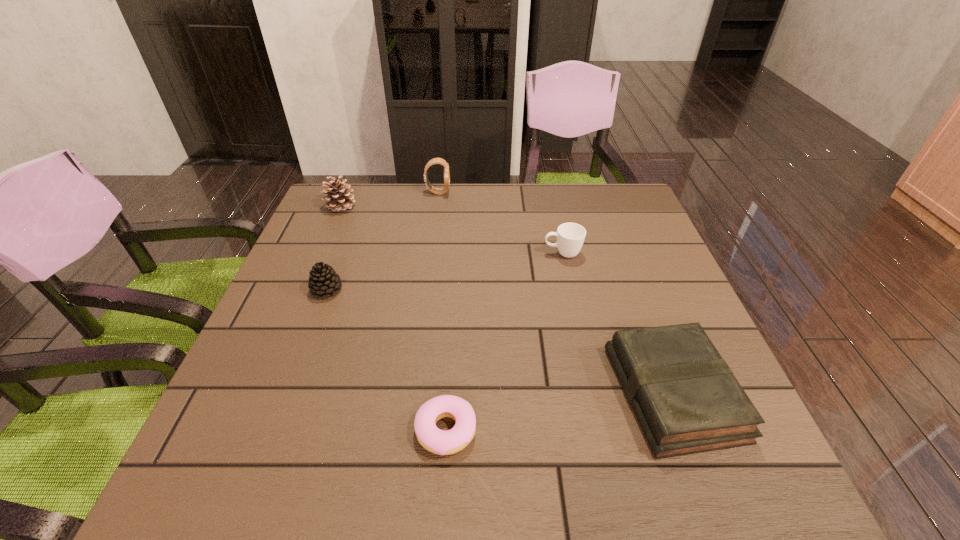
Where is `free space between the watch and the shortest object`? free space between the watch and the shortest object is located at coordinates (442, 312).

Identify the location of vacant region between the nearer pinecone and the cup. (444, 272).

At what (x,y) coordinates should I click in order to perform the action: click on vacant area that lies between the farthest object and the fourth farthest object. Please return your answer as a coordinate pair (x, y). Image resolution: width=960 pixels, height=540 pixels. Looking at the image, I should click on (382, 241).

The width and height of the screenshot is (960, 540). I want to click on free spot between the doughnut and the farther pinecone, so click(394, 319).

I want to click on free space between the watch and the nearer pinecone, so click(382, 241).

Find the location of `free spot between the third nearest object and the second farthest object`. free spot between the third nearest object and the second farthest object is located at coordinates (334, 248).

I want to click on vacant area that lies between the farther pinecone and the doughnut, so click(x=394, y=319).

Where is `free space between the book and the farthest object`? free space between the book and the farthest object is located at coordinates (556, 293).

Locate an element on the screen. empty location between the taller pinecone and the shortest object is located at coordinates (394, 319).

Find the location of a particular element. object that is the fourth closest to the farther pinecone is located at coordinates (437, 441).